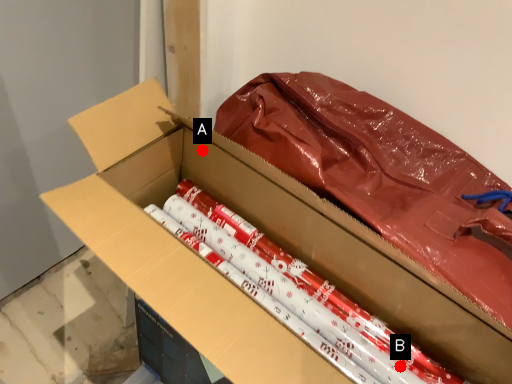
Question: Two points are circled on the image, labeled by A and B beside each circle. Which point appears closest to the camera in this image?

Choices:
 (A) A is closer
 (B) B is closer

Answer: (B)